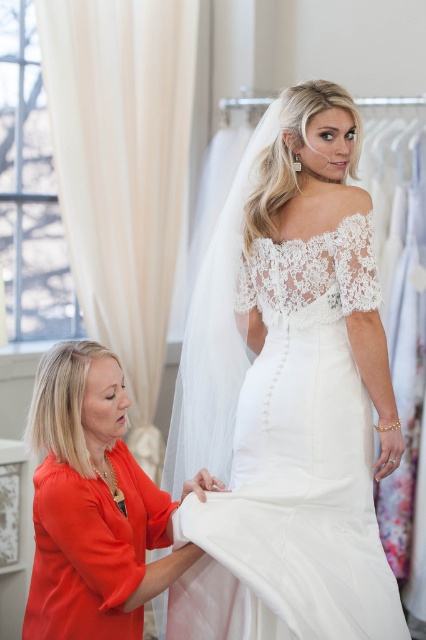
Question: Is white satin dress at center positioned behind matte orange blouse at lower left?

Choices:
 (A) yes
 (B) no

Answer: (B)

Question: Which object is closer to the camera taking this photo?

Choices:
 (A) matte orange blouse at lower left
 (B) white satin dress at center

Answer: (B)

Question: In this image, where is white satin dress at center located relative to matte orange blouse at lower left?

Choices:
 (A) above
 (B) below

Answer: (A)

Question: Does white satin dress at center appear on the left side of matte orange blouse at lower left?

Choices:
 (A) yes
 (B) no

Answer: (B)

Question: Among these points, which one is farthest from the camera?

Choices:
 (A) (115, 611)
 (B) (268, 236)

Answer: (B)